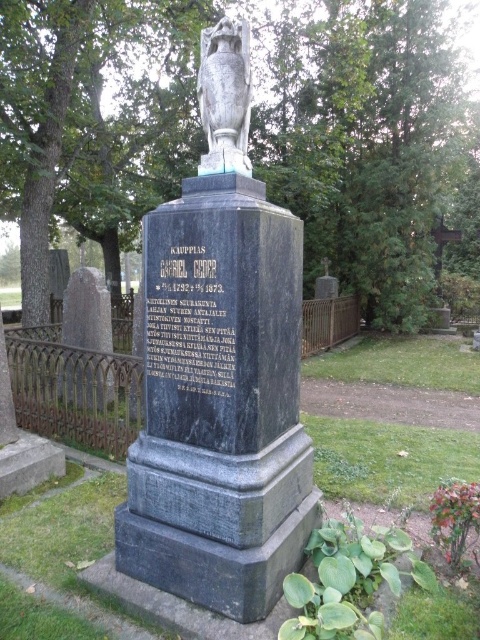
Question: Does polished gray stone monument at center come in front of gray stone urn at center?

Choices:
 (A) no
 (B) yes

Answer: (B)

Question: Which point is farther to the camera?

Choices:
 (A) polished gray stone monument at center
 (B) gray stone urn at center

Answer: (B)

Question: Is polished gray stone monument at center further to the viewer compared to gray stone urn at center?

Choices:
 (A) yes
 (B) no

Answer: (B)

Question: Can you confirm if polished gray stone monument at center is smaller than gray stone urn at center?

Choices:
 (A) no
 (B) yes

Answer: (A)